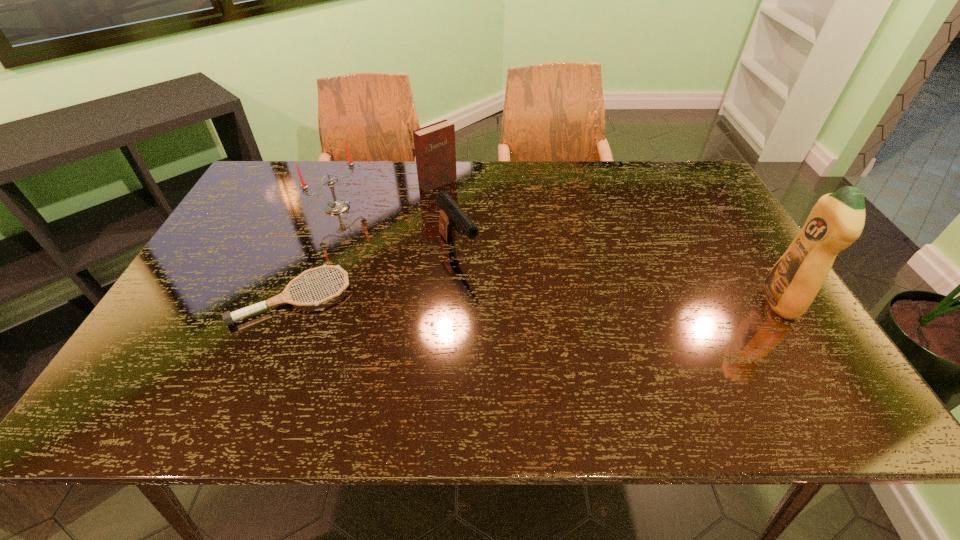
The image size is (960, 540). I want to click on vacant region between the second shortest object and the candle, so click(x=397, y=229).

Identify the location of free spot between the second farthest object and the pistol. Image resolution: width=960 pixels, height=540 pixels. (397, 229).

Find the location of a particular element. This screenshot has height=540, width=960. vacant area between the fourth nearest object and the second shortest object is located at coordinates (397, 229).

This screenshot has height=540, width=960. Identify the location of vacant area that lies between the second shortest object and the detergent. (618, 276).

The height and width of the screenshot is (540, 960). Find the location of `free space between the tennis racket and the second farthest object`. free space between the tennis racket and the second farthest object is located at coordinates (315, 252).

Where is `empty location between the shortest object and the fourth nearest object`? empty location between the shortest object and the fourth nearest object is located at coordinates (315, 252).

Where is `free space between the fourth tallest object and the shortest object`? free space between the fourth tallest object and the shortest object is located at coordinates (375, 274).

The height and width of the screenshot is (540, 960). I want to click on unoccupied area between the fourth nearest object and the farthest object, so tap(388, 195).

You are a GUI agent. You are given a task and a screenshot of the screen. Output one action in this format:
    pyautogui.click(x=<x>, y=<y>)
    Task: Click on the free space that is in between the second farthest object and the detergent
    This screenshot has width=960, height=540.
    Given the screenshot: What is the action you would take?
    pyautogui.click(x=559, y=254)

Identify the location of vacant point located between the second farthest object and the pistol. Image resolution: width=960 pixels, height=540 pixels. (397, 229).